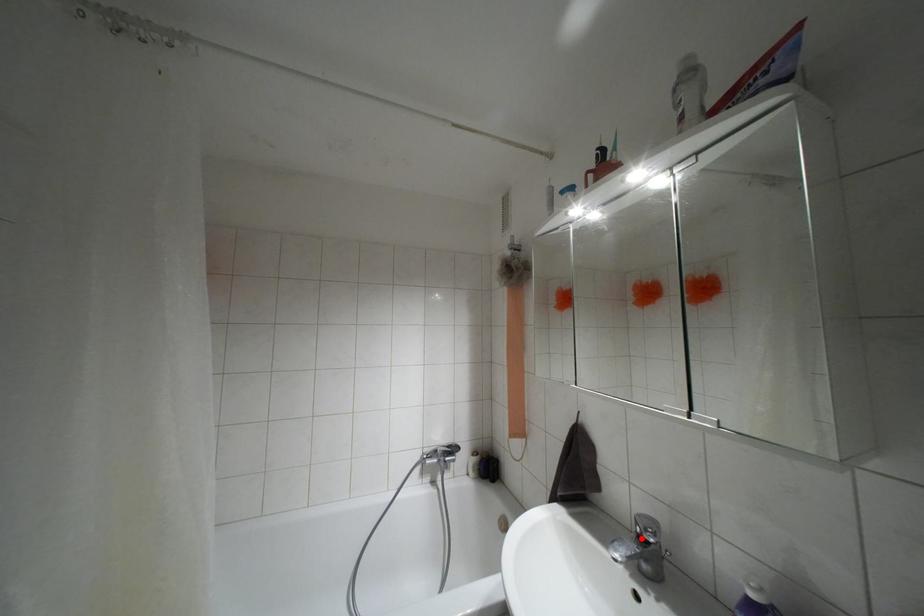
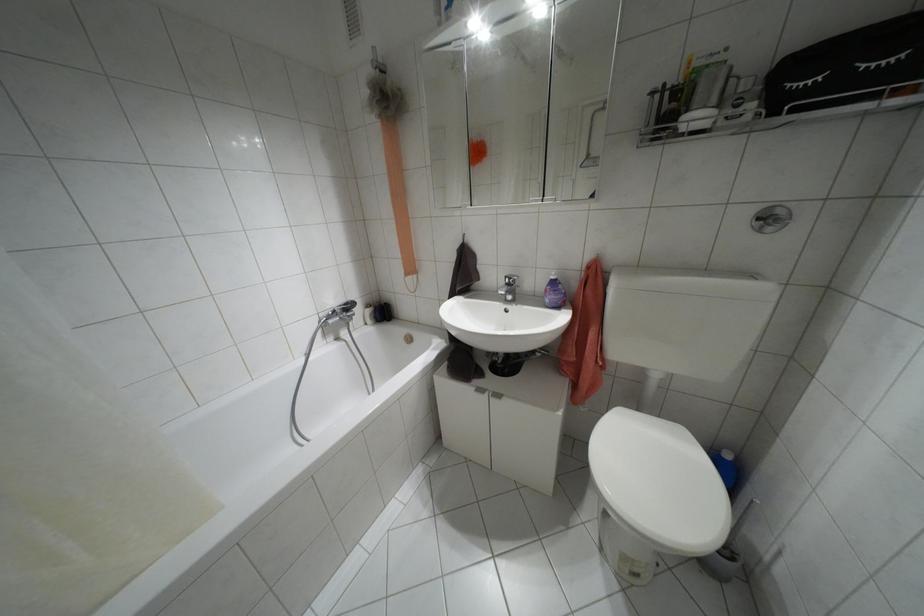
Where in the second image is the point corresponding to the highlighted location from the first image?

(507, 284)